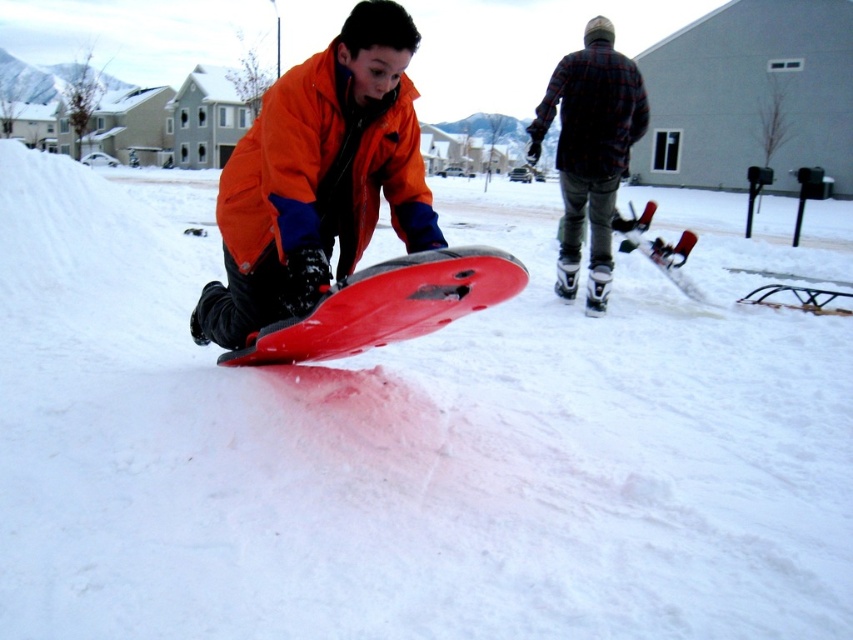
Which is below, flannel plaid shirt at upper right or shiny plastic snowboard at center?

shiny plastic snowboard at center is lower down.

Locate an element on the screen. The width and height of the screenshot is (853, 640). flannel plaid shirt at upper right is located at coordinates (590, 150).

Locate an element on the screen. The image size is (853, 640). flannel plaid shirt at upper right is located at coordinates (590, 150).

Which is more to the right, orange fleece jacket at center or flannel plaid shirt at upper right?

flannel plaid shirt at upper right is more to the right.

Locate an element on the screen. The image size is (853, 640). orange fleece jacket at center is located at coordinates (323, 170).

Locate an element on the screen. orange fleece jacket at center is located at coordinates (323, 170).

Does matte plastic snowboard at center have a lesser width compared to flannel plaid shirt at upper right?

No, matte plastic snowboard at center is not thinner than flannel plaid shirt at upper right.

Between matte plastic snowboard at center and flannel plaid shirt at upper right, which one has more height?

matte plastic snowboard at center is taller.

Between point (401, 291) and point (573, 237), which one is positioned in front?

Positioned in front is point (401, 291).

The width and height of the screenshot is (853, 640). Find the location of `matte plastic snowboard at center`. matte plastic snowboard at center is located at coordinates (337, 212).